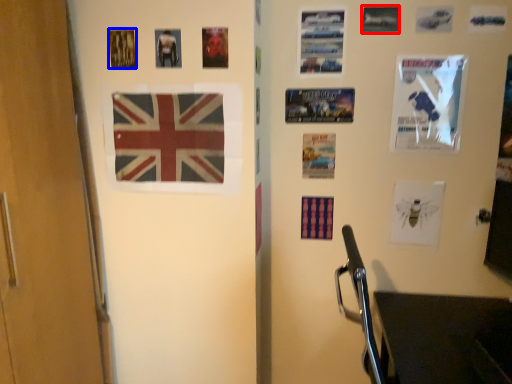
Question: Which object appears farthest to the camera in this image, poster page (highlighted by a red box) or poster page (highlighted by a blue box)?

Choices:
 (A) poster page
 (B) poster page

Answer: (A)